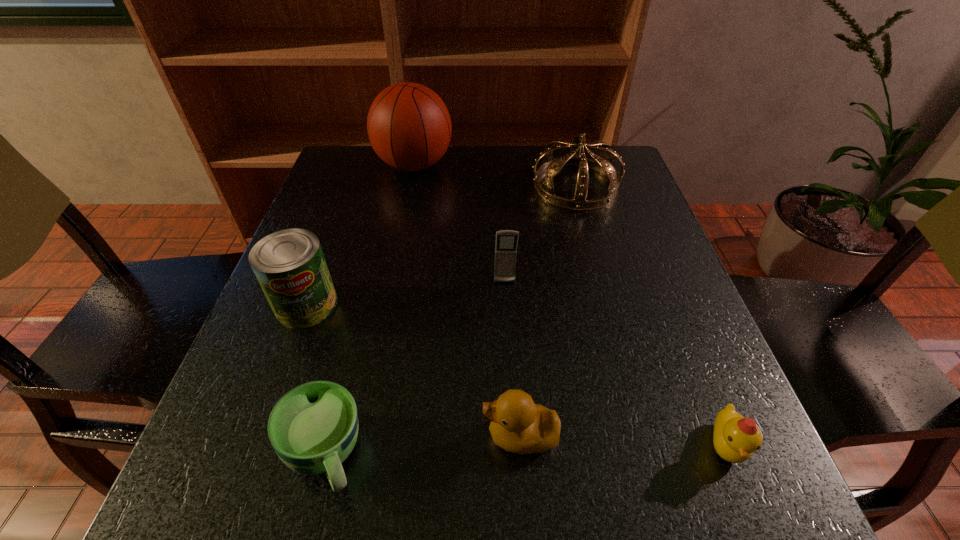
The height and width of the screenshot is (540, 960). Identify the location of cup situated at the left edge. (313, 428).

Where is `tiara that is positioned at the right edge`? Image resolution: width=960 pixels, height=540 pixels. tiara that is positioned at the right edge is located at coordinates (602, 163).

Find the location of a particular element. The height and width of the screenshot is (540, 960). duckling situated at the right edge is located at coordinates (x=735, y=438).

At what (x,y) coordinates should I click in order to perform the action: click on object that is at the far left corner. Please return your answer as a coordinate pair (x, y). The height and width of the screenshot is (540, 960). Looking at the image, I should click on (409, 127).

Locate an element on the screen. This screenshot has width=960, height=540. object at the near left corner is located at coordinates (313, 428).

Identify the location of object at the far right corner. (602, 163).

The image size is (960, 540). Find the location of `object at the near right corner`. object at the near right corner is located at coordinates (735, 438).

This screenshot has height=540, width=960. I want to click on free space at the far edge of the desktop, so click(x=478, y=191).

The image size is (960, 540). In the image, there is a desktop. Find the location of `free space at the near edge`. free space at the near edge is located at coordinates (601, 501).

Where is `blank area at the left edge`? This screenshot has height=540, width=960. blank area at the left edge is located at coordinates (312, 340).